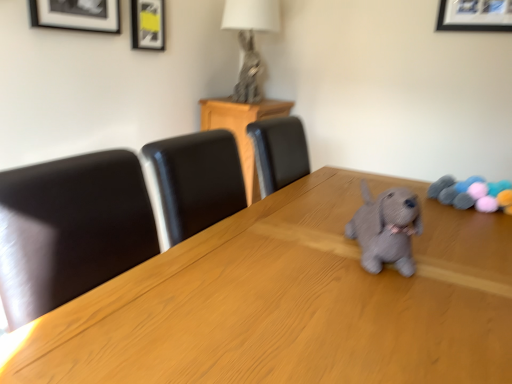
Find the location of `vacant space in front of gray knitted dog at center`. vacant space in front of gray knitted dog at center is located at coordinates (400, 307).